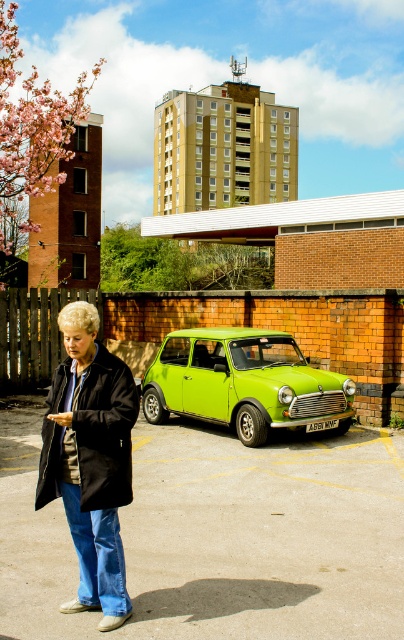
Question: Estimate the real-world distances between objects in this image. Which object is farther from the smooth asphalt parking lot at center?

Choices:
 (A) blue denim jeans at lower left
 (B) matte black coat at center
 (C) lime green metallic car at center

Answer: (B)

Question: Which point is closer to the camera taking this photo?

Choices:
 (A) (105, 378)
 (B) (107, 516)
 (C) (340, 560)
 (D) (193, 380)

Answer: (B)

Question: Does smooth asphalt parking lot at center come behind blue denim jeans at lower left?

Choices:
 (A) yes
 (B) no

Answer: (A)

Question: Which object appears closest to the camera in this image?

Choices:
 (A) matte black coat at center
 (B) smooth asphalt parking lot at center
 (C) blue denim jeans at lower left
 (D) lime green metallic car at center

Answer: (A)

Question: Is smooth asphalt parking lot at center behind lime green metallic car at center?

Choices:
 (A) yes
 (B) no

Answer: (B)

Question: Is matte black coat at center closer to the viewer compared to blue denim jeans at lower left?

Choices:
 (A) yes
 (B) no

Answer: (A)